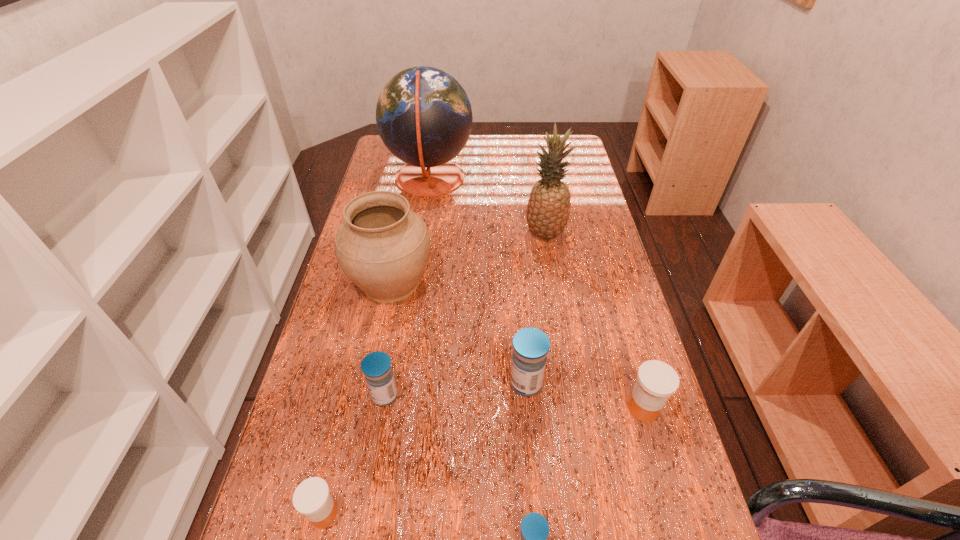
I want to click on urn present at the left edge, so pyautogui.click(x=383, y=247).

At what (x,y) coordinates should I click in order to perform the action: click on pineapple that is positioned at the right edge. Please return your answer as a coordinate pair (x, y). This screenshot has height=540, width=960. Looking at the image, I should click on (548, 209).

The height and width of the screenshot is (540, 960). In order to click on medicine at the right edge in this screenshot , I will do `click(656, 381)`.

I want to click on object that is at the far left corner, so click(424, 117).

Locate an element on the screen. vacant space at the far edge is located at coordinates (500, 156).

At what (x,y) coordinates should I click in order to perform the action: click on free spot at the left edge of the desktop. Please return your answer as a coordinate pair (x, y). The image size is (960, 540). Looking at the image, I should click on point(331,420).

Locate an element on the screen. vacant region at the right edge of the desktop is located at coordinates (616, 435).

Find the location of a particular element. Image resolution: width=960 pixels, height=540 pixels. free space at the far right corner is located at coordinates (571, 153).

Identify the location of vacant point located between the rightmost object and the smaller orange medicine. (484, 461).

The image size is (960, 540). In order to click on blank region between the third tallest object and the nearer orange medicine in this screenshot , I will do `click(357, 398)`.